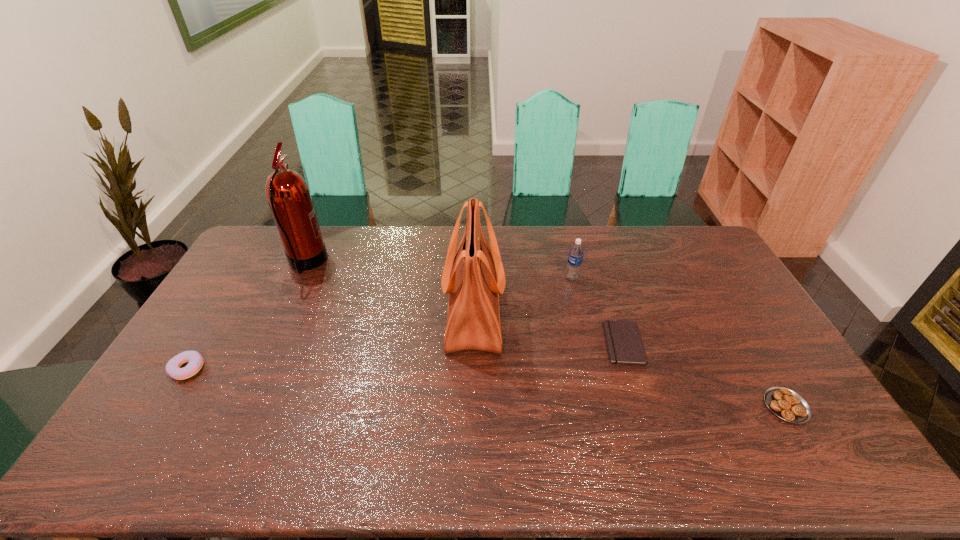
This screenshot has width=960, height=540. Identify the location of checkbook. (623, 339).

Locate an element on the screen. The image size is (960, 540). free space located on the front-facing side of the second object from left to right is located at coordinates (417, 264).

Where is `free space located on the front pocket of the third object from left to right`? Image resolution: width=960 pixels, height=540 pixels. free space located on the front pocket of the third object from left to right is located at coordinates coord(611,313).

Where is `vacant space located on the right of the fourth shortest object`? This screenshot has height=540, width=960. vacant space located on the right of the fourth shortest object is located at coordinates (673, 278).

Find the location of a particular element. The height and width of the screenshot is (540, 960). free point located on the right of the doughnut is located at coordinates (331, 368).

What are the coordinates of `vacant region located 0.110m on the front of the pastry` in the screenshot? It's located at (822, 466).

Locate an element on the screen. This screenshot has height=540, width=960. vacant area located 0.200m on the right of the second object from right to left is located at coordinates (708, 343).

At what (x,y) coordinates should I click in order to perform the action: click on object located at the far edge. Please return your answer as a coordinate pair (x, y). The image size is (960, 540). Looking at the image, I should click on (288, 195).

Find the location of `object that is at the left edge`. object that is at the left edge is located at coordinates (195, 360).

Identify the location of object present at the right edge. The height and width of the screenshot is (540, 960). (786, 404).